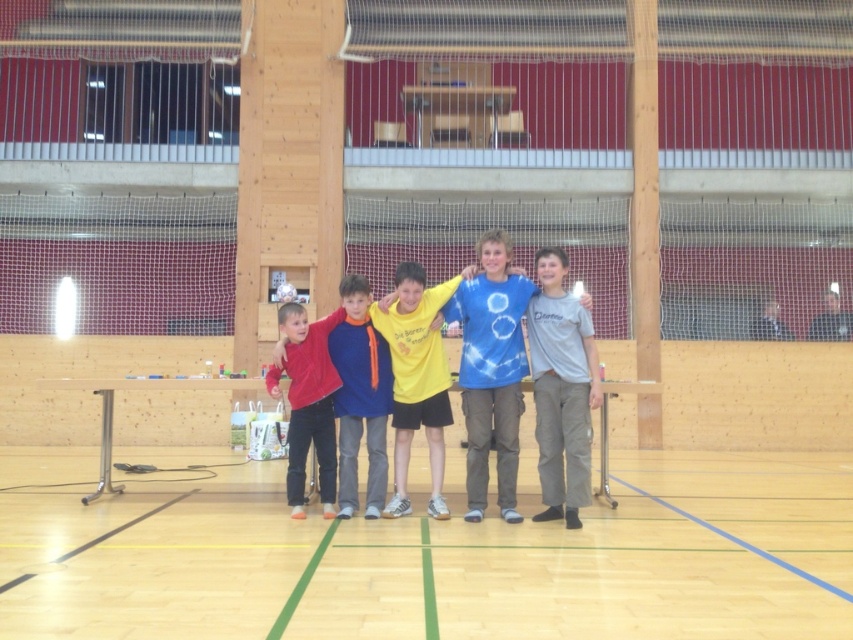
Between point (138, 525) and point (488, 404), which one is positioned behind?

The point (488, 404) is more distant.

This screenshot has width=853, height=640. Find the location of `wooden floor at center`. wooden floor at center is located at coordinates (428, 557).

Is point (338, 604) behind point (469, 284)?

No, (338, 604) is closer to viewer.

The height and width of the screenshot is (640, 853). I want to click on wooden floor at center, so click(428, 557).

Looking at this image, does gray cotton shirt at right have a smaller size compared to dark gray shirt at right?

No.

Does gray cotton shirt at right appear on the right side of dark gray shirt at right?

In fact, gray cotton shirt at right is to the left of dark gray shirt at right.

Find the location of a particular element. Image resolution: width=853 pixels, height=640 pixels. gray cotton shirt at right is located at coordinates (561, 388).

The width and height of the screenshot is (853, 640). I want to click on gray cotton shirt at right, so click(561, 388).

Measure the distance between point (x=450, y=420) and camera.

Point (x=450, y=420) and camera are 29.06 feet apart from each other.

Find the location of a particular element. This screenshot has width=853, height=640. yellow matte shirt at center is located at coordinates (416, 378).